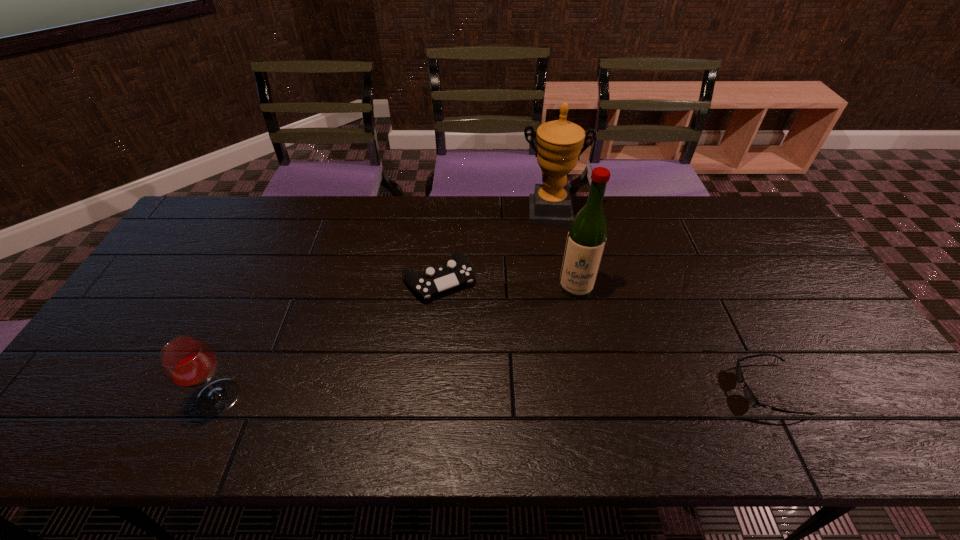
Locate an element on the screen. vacant point located on the front-facing side of the shortest object is located at coordinates (712, 389).

Where is `blank area located on the front-facing side of the shortest object`? blank area located on the front-facing side of the shortest object is located at coordinates (654, 389).

The width and height of the screenshot is (960, 540). What are the coordinates of `vacant region located 0.120m on the surface of the fourth object from right to left` in the screenshot? It's located at (472, 333).

What are the coordinates of `free space located on the surface of the fourth object from right to left` in the screenshot? It's located at (516, 403).

What are the coordinates of `vacant space located 0.280m on the surface of the fourth object from right to left` in the screenshot? It's located at (501, 380).

The width and height of the screenshot is (960, 540). I want to click on free space located 0.300m at the front of the farthest object with handles, so click(x=552, y=293).

Where is `vacant area situated 0.090m at the front of the farthest object with handles`? vacant area situated 0.090m at the front of the farthest object with handles is located at coordinates (550, 244).

Find the location of a particular element. vacant space located at the front of the farthest object with handles is located at coordinates (552, 290).

The height and width of the screenshot is (540, 960). I want to click on vacant area situated 0.130m on the label of the liquor, so click(x=570, y=335).

The width and height of the screenshot is (960, 540). In order to click on vacant space located on the label of the liquor in this screenshot , I will do `click(563, 399)`.